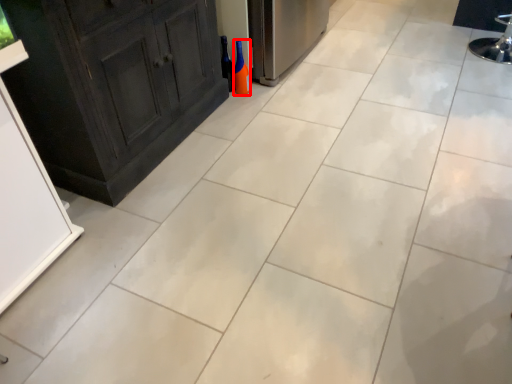
Question: Where is bottle (annotated by the red box) located in relation to wine bottle in the image?

Choices:
 (A) right
 (B) left

Answer: (A)